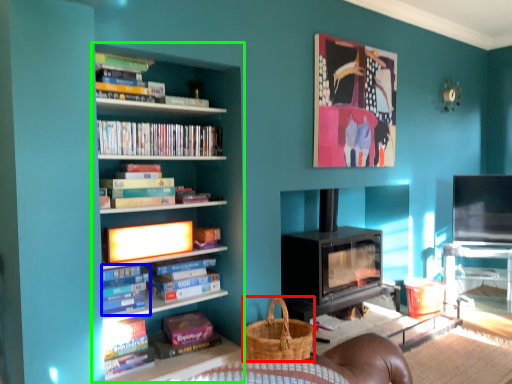
Question: Considering the real-world distances, which object is farthest from basket (highlighted by a red box)? book (highlighted by a blue box) or bookcase (highlighted by a green box)?

Choices:
 (A) book
 (B) bookcase

Answer: (A)